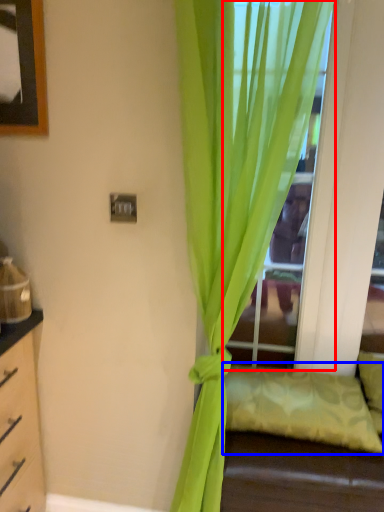
Question: Which object appears farthest to the camera in this image, glass door (highlighted by a red box) or pillow (highlighted by a blue box)?

Choices:
 (A) glass door
 (B) pillow

Answer: (A)